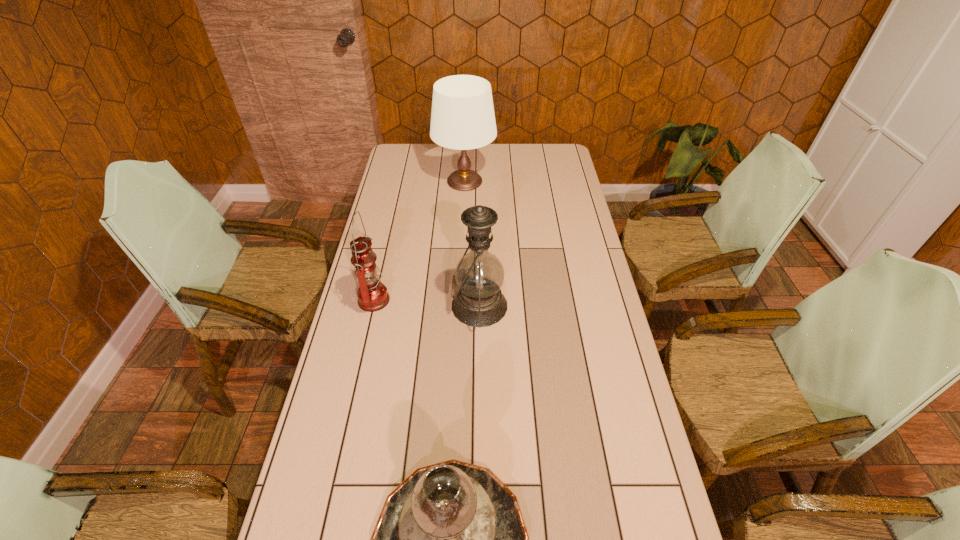
This screenshot has height=540, width=960. Find the location of `free area in between the farthest object and the leftmost oil lamp`. free area in between the farthest object and the leftmost oil lamp is located at coordinates (420, 241).

You are a GUI agent. You are given a task and a screenshot of the screen. Output one action in this format:
    pyautogui.click(x=<x>, y=<y>)
    Task: Click on the vacant area that lies between the leftmost object and the lamp
    This screenshot has height=540, width=960.
    Given the screenshot: What is the action you would take?
    pyautogui.click(x=420, y=241)

This screenshot has width=960, height=540. Identify the location of blank region between the lamp and the leftmost object. (420, 241).

Choose which object is the second nearest neighbor to the nearest oil lamp. Please provide its 2D coordinates. Your answer should be formatted as a tuple, i.e. [(x, y)], where the tuple contains the x and y coordinates of a point satisfying the conditions above.

[(372, 294)]

This screenshot has width=960, height=540. I want to click on object that stands as the closest to the leftmost object, so click(x=479, y=275).

Where is `oil lamp object that ranks as the closest to the nearest oil lamp`? This screenshot has height=540, width=960. oil lamp object that ranks as the closest to the nearest oil lamp is located at coordinates (479, 275).

Identify which oil lamp is the closest to the nearest oil lamp. Please provide its 2D coordinates. Your answer should be formatted as a tuple, i.e. [(x, y)], where the tuple contains the x and y coordinates of a point satisfying the conditions above.

[(479, 275)]

The image size is (960, 540). In order to click on vacant space that satisfies the following two spatial constraints: 1. on the back side of the leftmost object; 2. on the left side of the farthest object in this screenshot , I will do `click(401, 181)`.